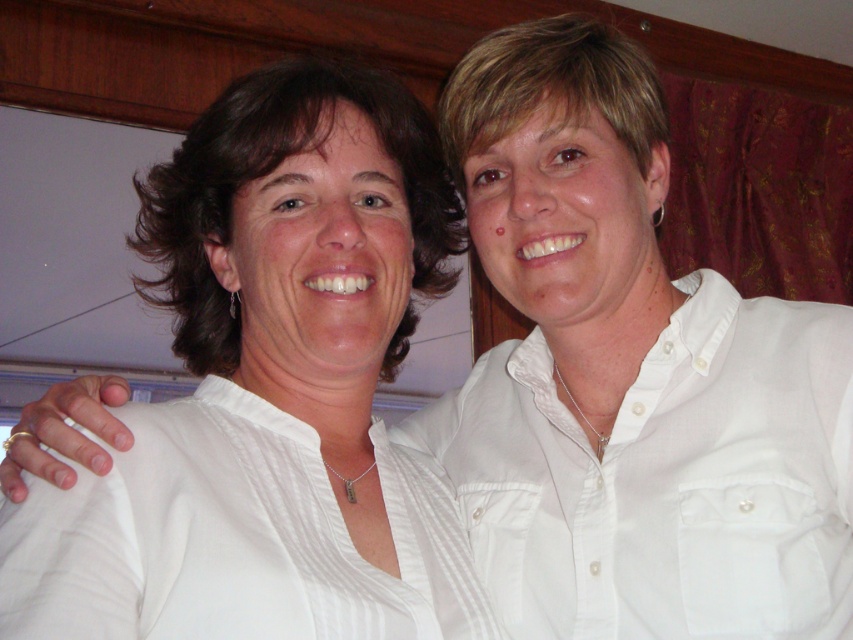
Question: Which point appears farthest from the camera in this image?

Choices:
 (A) (320, 563)
 (B) (799, 522)

Answer: (B)

Question: Which point is farther to the camera?

Choices:
 (A) white cotton shirt at right
 (B) white smooth shirt at center
 (C) white striped shirt at left

Answer: (A)

Question: Based on their relative distances, which object is nearer to the white cotton shirt at right?

Choices:
 (A) white striped shirt at left
 (B) white smooth shirt at center

Answer: (A)

Question: Can you confirm if white smooth shirt at center is bigger than white striped shirt at left?

Choices:
 (A) yes
 (B) no

Answer: (A)

Question: Can you confirm if white smooth shirt at center is wider than white striped shirt at left?

Choices:
 (A) yes
 (B) no

Answer: (A)

Question: Does white smooth shirt at center have a larger size compared to white striped shirt at left?

Choices:
 (A) yes
 (B) no

Answer: (A)